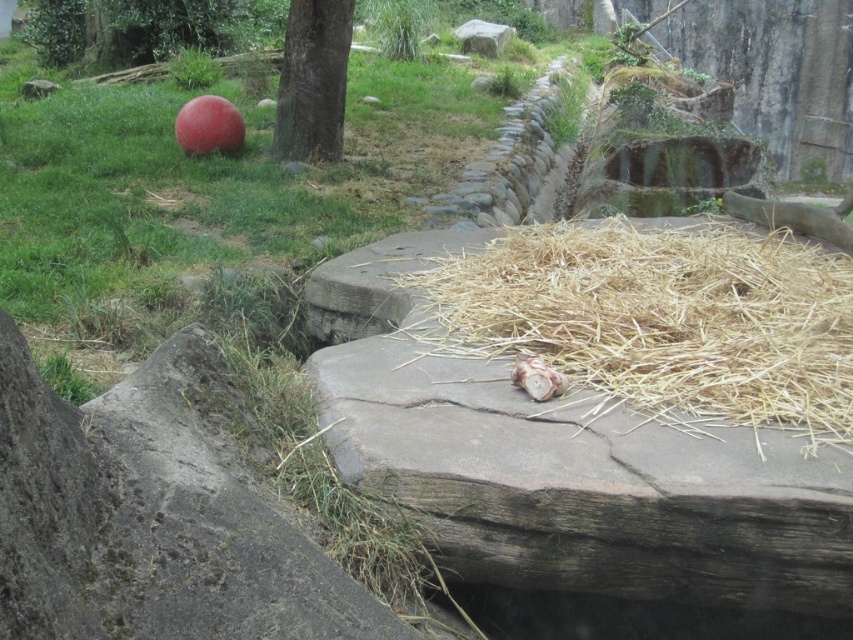
Is brown textured log at center smaller than smooth gray rock at upper center?

Yes.

Locate an element on the screen. brown textured log at center is located at coordinates (537, 378).

Identify the location of brown textured log at center. (537, 378).

Consider the image. Is the position of brown rough bark tree at upper center less distant than that of brown textured log at center?

No, brown rough bark tree at upper center is further to the viewer.

Which is below, brown rough bark tree at upper center or brown textured log at center?

brown textured log at center is lower down.

Which is behind, point (317, 108) or point (548, 388)?

Positioned behind is point (317, 108).

Where is `brown rough bark tree at upper center`? The width and height of the screenshot is (853, 640). brown rough bark tree at upper center is located at coordinates (312, 81).

Is brown straw at center further to the viewer compared to smooth gray rock at upper center?

That is False.

Does point (480, 298) come farther from viewer compared to point (492, 54)?

No, (480, 298) is in front of (492, 54).

The height and width of the screenshot is (640, 853). Find the location of `brown straw at center`. brown straw at center is located at coordinates (662, 320).